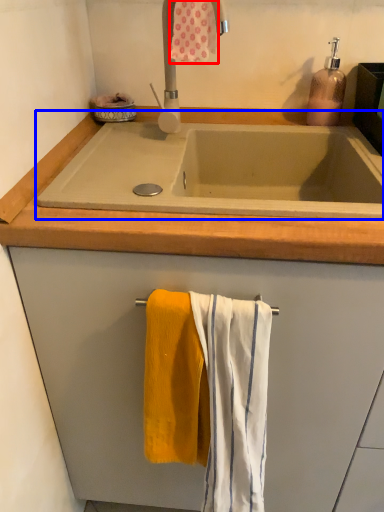
Question: Which object appears closest to the camera in this image, bath towel (highlighted by a red box) or bath (highlighted by a blue box)?

Choices:
 (A) bath towel
 (B) bath

Answer: (B)